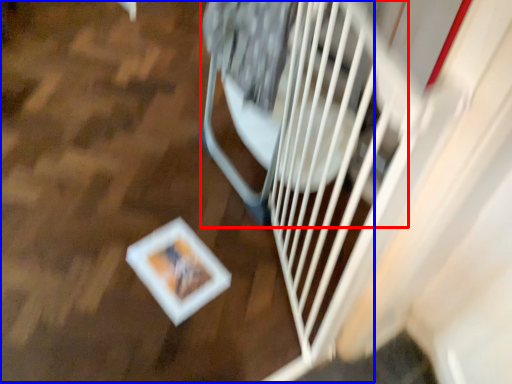
Question: Among these objects, which one is nearest to the camera, wide (highlighted by a red box) or wood (highlighted by a blue box)?

Choices:
 (A) wide
 (B) wood

Answer: (A)